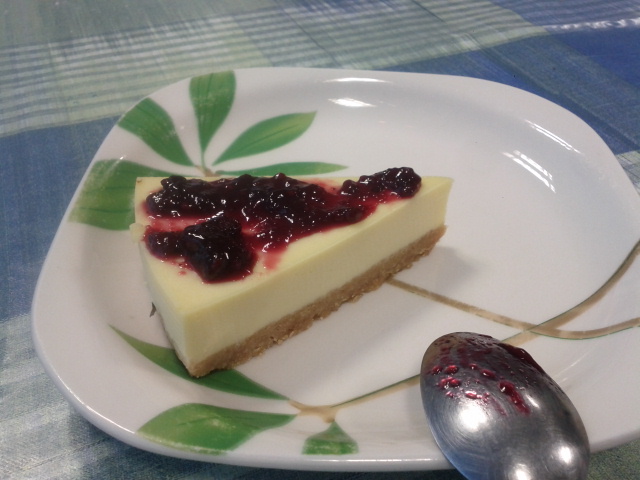
This screenshot has width=640, height=480. Find the location of `blue area on tablecloth`. blue area on tablecloth is located at coordinates (13, 265).